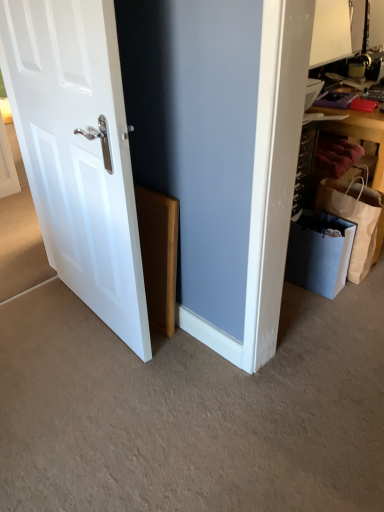
Question: Considering the positions of white glossy door at left and white paper shopping bag at right in the image, is white glossy door at left taller or shorter than white paper shopping bag at right?

Choices:
 (A) tall
 (B) short

Answer: (A)

Question: From the image's perspective, is white glossy door at left positioned above or below white paper shopping bag at right?

Choices:
 (A) above
 (B) below

Answer: (A)

Question: Looking at their shapes, would you say white glossy door at left is wider or thinner than white paper shopping bag at right?

Choices:
 (A) thin
 (B) wide

Answer: (A)

Question: Is point (340, 207) positioned closer to the camera than point (132, 347)?

Choices:
 (A) farther
 (B) closer

Answer: (A)

Question: From a real-world perspective, is white paper shopping bag at right above or below white glossy door at left?

Choices:
 (A) below
 (B) above

Answer: (A)

Question: Looking at the image, does white paper shopping bag at right seem bigger or smaller compared to white glossy door at left?

Choices:
 (A) big
 (B) small

Answer: (B)

Question: Is white paper shopping bag at right to the left or to the right of white glossy door at left in the image?

Choices:
 (A) right
 (B) left

Answer: (A)